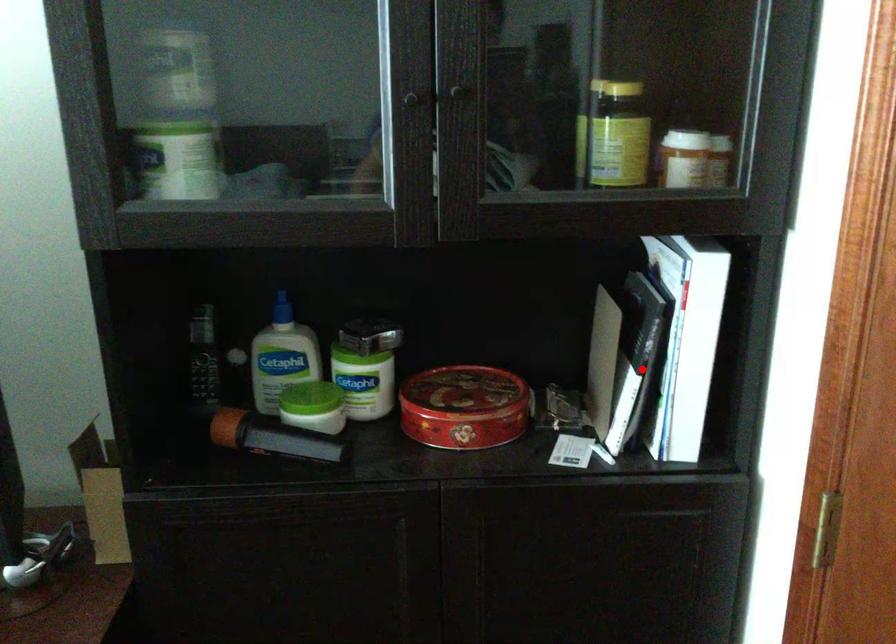
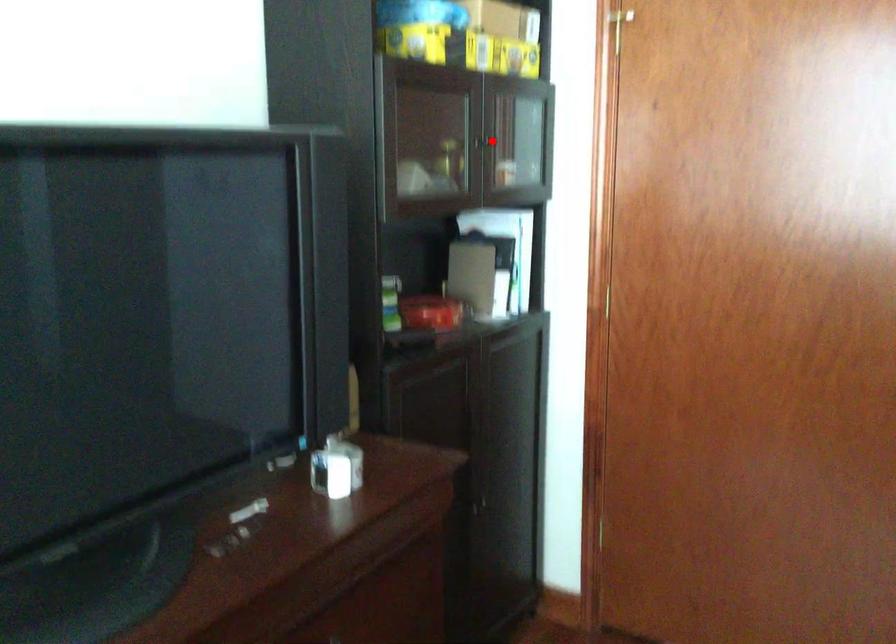
Looking at this image, I am providing you with two images of the same scene from different viewpoints. A red point is marked on the first image and another point is marked on the second image. Are the points marked in image1 and image2 representing the same 3D position?

No